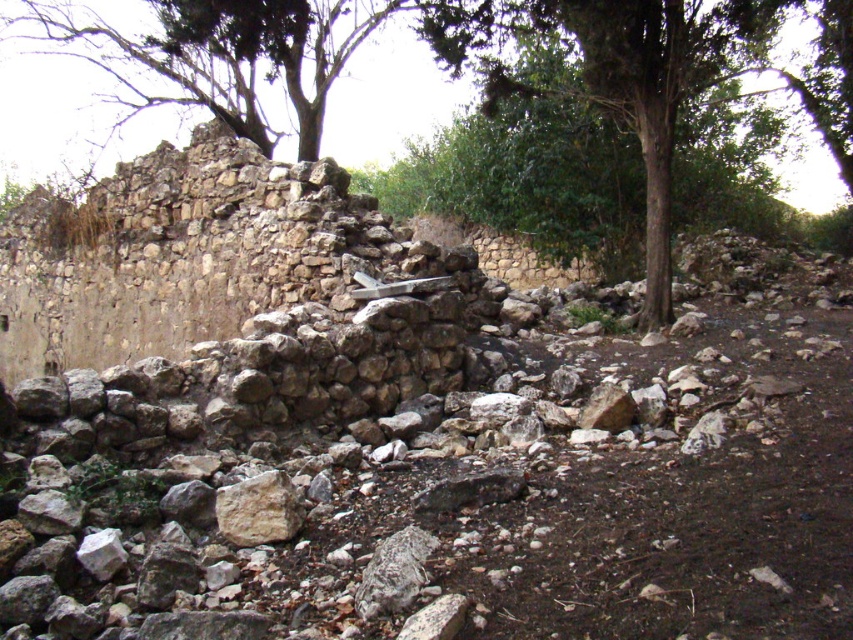
Question: Which object is the farthest from the green leafy tree at upper center?

Choices:
 (A) green leafy tree at center
 (B) smooth beige rock at center

Answer: (B)

Question: Which object is the farthest from the green leafy tree at upper center?

Choices:
 (A) smooth beige rock at center
 (B) green leafy tree at center

Answer: (A)

Question: Does green leafy tree at upper center appear over green leafy tree at center?

Choices:
 (A) no
 (B) yes

Answer: (B)

Question: Can you confirm if green leafy tree at center is thinner than smooth beige rock at center?

Choices:
 (A) no
 (B) yes

Answer: (A)

Question: Does green leafy tree at center appear under smooth beige rock at center?

Choices:
 (A) yes
 (B) no

Answer: (B)

Question: Which of these objects is positioned closest to the green leafy tree at center?

Choices:
 (A) smooth beige rock at center
 (B) green leafy tree at upper center

Answer: (A)